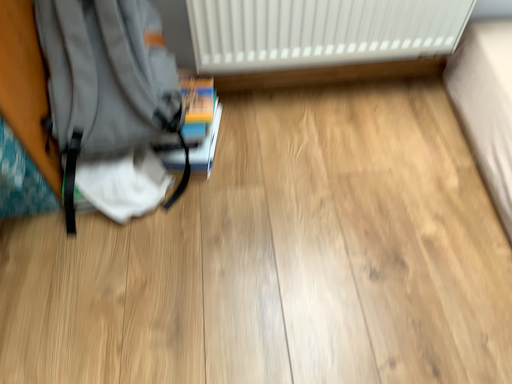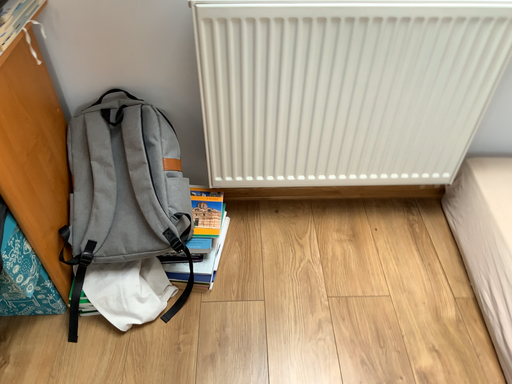
Question: Which way did the camera rotate in the video?

Choices:
 (A) rotated downward
 (B) rotated upward

Answer: (B)